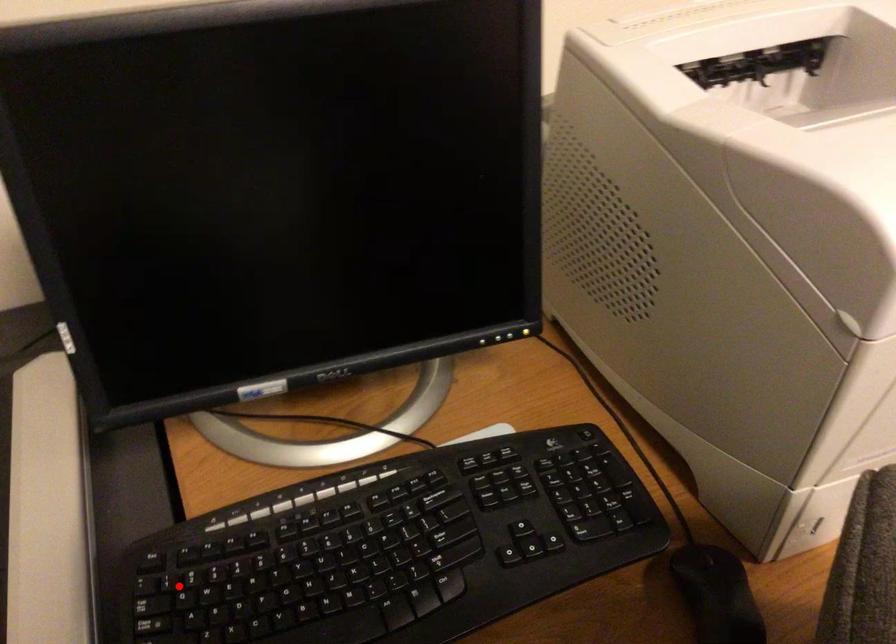
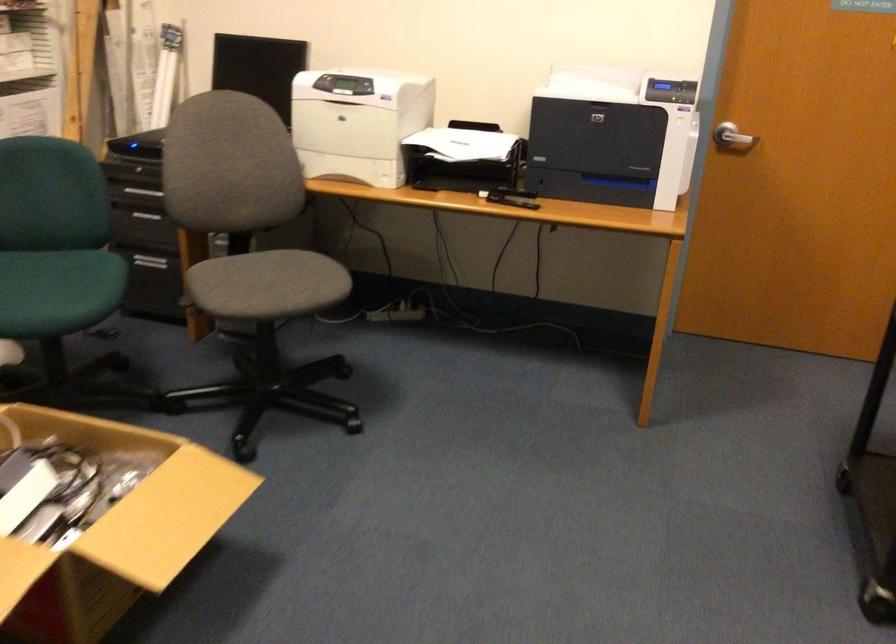
Question: I am providing you with two images of the same scene from different viewpoints. A red point is marked on the first image. Is the red point's position out of view in image 2?

Choices:
 (A) Yes
 (B) No

Answer: (A)